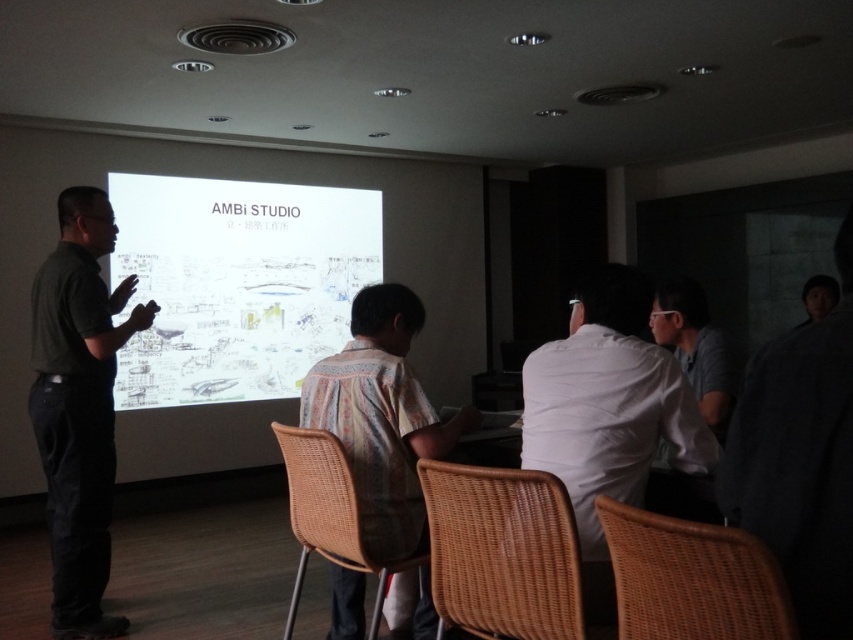
You are a presenter standing at the front of the room. You notice two points on the projection screen. The first point is at coordinates point (49, 476) and the second is at point (637, 612). Which point is closer to the audience sitting in front of the screen?

Point (49, 476) is behind point (637, 612), so the point closer to the audience is point (637, 612).

You are a presenter standing at the front of the room. You need to move from your current position to the woven brown chair at lower center to pick up a handout. However, there is another woven brown chair at lower right in the way. Is there enough space to walk around it to reach the chair you need?

The woven brown chair at lower right and woven brown chair at lower center are 1.11 meters apart. Since the chairs are only 1.11 meters apart, there might not be enough space to comfortably walk around the chair at lower right to reach the one at lower center. You may need to adjust your path or move the chair temporarily.

You are an attendee at the presentation and need to locate the presenter. Where is the white matte shirt at center located in the image?

The white matte shirt at center is located at point (608,413) in the image.